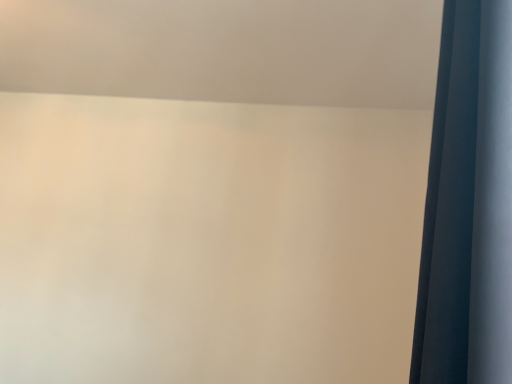
What is the approximate height of satin dark blue curtain at right?

The height of satin dark blue curtain at right is 32.59 inches.

This screenshot has width=512, height=384. I want to click on satin dark blue curtain at right, so click(x=468, y=205).

The width and height of the screenshot is (512, 384). What do you see at coordinates (468, 205) in the screenshot? I see `satin dark blue curtain at right` at bounding box center [468, 205].

Identify the location of satin dark blue curtain at right. (468, 205).